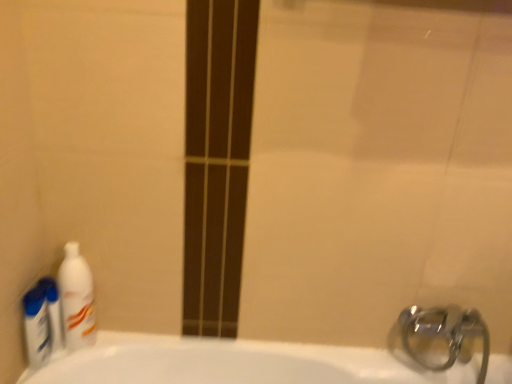
Question: Considering the positions of white glossy bottle at left, which is the 2th cleaning product from left to right, and blue plastic bottles at left, arranged as the 1th cleaning product when viewed from the left, in the image, is white glossy bottle at left, which is the 2th cleaning product from left to right, wider or thinner than blue plastic bottles at left, arranged as the 1th cleaning product when viewed from the left,?

Choices:
 (A) wide
 (B) thin

Answer: (A)

Question: Considering the positions of point (58, 276) and point (47, 311), is point (58, 276) closer or farther from the camera than point (47, 311)?

Choices:
 (A) farther
 (B) closer

Answer: (A)

Question: Estimate the real-world distances between objects in this image. Which object is farther from the blue plastic bottles at left, arranged as the 1th cleaning product when viewed from the left?

Choices:
 (A) white glossy bottle at left, which is the 1th cleaning product in right-to-left order
 (B) white glossy mouthwash at left

Answer: (A)

Question: Which is nearer to the blue plastic bottles at left, which is the 2th cleaning product from right to left?

Choices:
 (A) white glossy bottle at left, which is the 1th cleaning product in right-to-left order
 (B) white glossy mouthwash at left

Answer: (B)